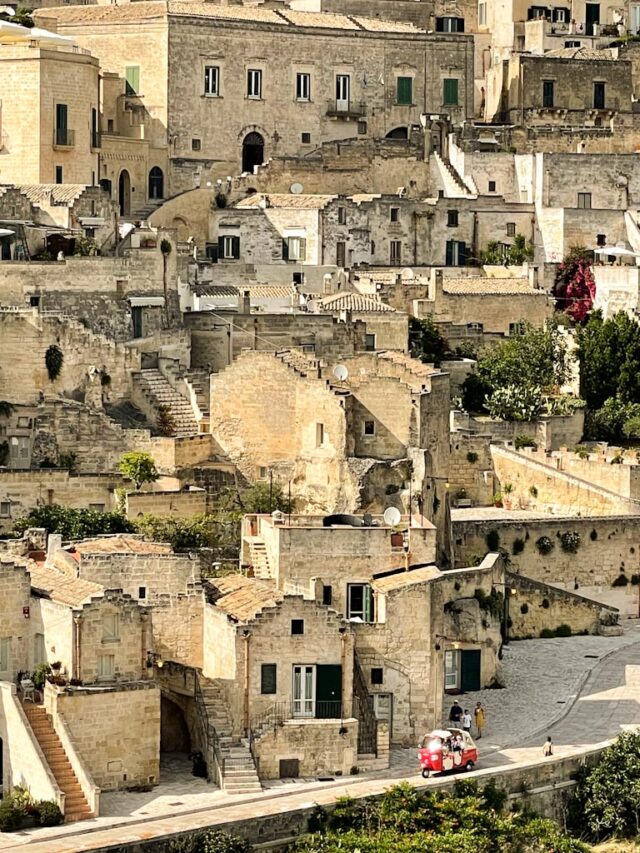
Where is `staircases`? staircases is located at coordinates (51, 775), (236, 772), (182, 405), (458, 183), (148, 211), (367, 735).